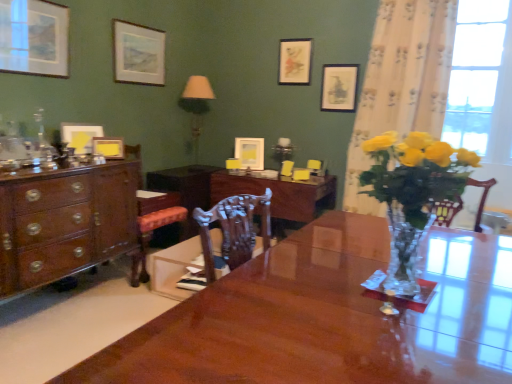
What do you see at coordinates (65, 222) in the screenshot?
I see `mahogany wood chest of drawers at left` at bounding box center [65, 222].

What do you see at coordinates (108, 147) in the screenshot?
I see `matte yellow picture frame at center, acting as the 5th picture frame starting from the right` at bounding box center [108, 147].

Locate an element on the screen. Image resolution: width=512 pixels, height=384 pixels. wooden table at center is located at coordinates (279, 193).

How much space does matte white picture frame at upper left, which is the first picture frame from left to right, occupy vertically?

19.13 inches.

Describe the element at coordinates (287, 168) in the screenshot. The image size is (512, 384). I see `wooden armchair at center, acting as the 2th armchair starting from the right` at that location.

The width and height of the screenshot is (512, 384). Describe the element at coordinates (412, 193) in the screenshot. I see `translucent glass vase at center` at that location.

Where is `mahogany wood chest of drawers at left`? Image resolution: width=512 pixels, height=384 pixels. mahogany wood chest of drawers at left is located at coordinates (65, 222).

From a real-world perspective, is matte white picture frame at upper left, which is the first picture frame from left to right, above or below matte yellow picture frame at center, which is the 3th picture frame in left-to-right order?

From a real-world perspective, matte white picture frame at upper left, which is the first picture frame from left to right, is physically above matte yellow picture frame at center, which is the 3th picture frame in left-to-right order.

Does matte white picture frame at upper left, which is the first picture frame from left to right, have a greater width compared to matte yellow picture frame at center, which is the 3th picture frame in left-to-right order?

Incorrect, the width of matte white picture frame at upper left, which is the first picture frame from left to right, does not surpass that of matte yellow picture frame at center, which is the 3th picture frame in left-to-right order.

Are matte white picture frame at upper left, which is the first picture frame from left to right, and matte yellow picture frame at center, which is the 3th picture frame in left-to-right order, beside each other?

No, matte white picture frame at upper left, which is the first picture frame from left to right, is not with matte yellow picture frame at center, which is the 3th picture frame in left-to-right order.

Is matte white picture frame at upper left, the 7th picture frame positioned from the right, bigger or smaller than matte yellow picture frame at center, which is the 3th picture frame in left-to-right order?

Considering their sizes, matte white picture frame at upper left, the 7th picture frame positioned from the right, takes up more space than matte yellow picture frame at center, which is the 3th picture frame in left-to-right order.

Can you confirm if white floral fabric curtain at right is taller than matte yellow picture frame at upper left, which is the 2th picture frame from left to right?

Yes.

Can matte yellow picture frame at upper left, which is counted as the 6th picture frame, starting from the right, be found inside white floral fabric curtain at right?

No.

From a real-world perspective, is white floral fabric curtain at right located higher than matte yellow picture frame at upper left, which is the 2th picture frame from left to right?

Indeed, from a real-world perspective, white floral fabric curtain at right stands above matte yellow picture frame at upper left, which is the 2th picture frame from left to right.

Does white floral fabric curtain at right turn towards matte yellow picture frame at upper left, which is the 2th picture frame from left to right?

No, white floral fabric curtain at right is not aimed at matte yellow picture frame at upper left, which is the 2th picture frame from left to right.

Considering the positions of objects matte white picture frame at upper center, which is the 4th picture frame from right to left, and matte white picture frame at upper left, which is the first picture frame from left to right, in the image provided, who is more to the left, matte white picture frame at upper center, which is the 4th picture frame from right to left, or matte white picture frame at upper left, which is the first picture frame from left to right,?

Positioned to the left is matte white picture frame at upper left, which is the first picture frame from left to right.

Can matte white picture frame at upper left, the 7th picture frame positioned from the right, be found inside matte white picture frame at upper center, the fourth picture frame viewed from the left?

That's incorrect, matte white picture frame at upper left, the 7th picture frame positioned from the right, is not inside matte white picture frame at upper center, the fourth picture frame viewed from the left.

Is matte white picture frame at upper center, which is the 4th picture frame from right to left, next to matte white picture frame at upper left, the 7th picture frame positioned from the right, and touching it?

No, matte white picture frame at upper center, which is the 4th picture frame from right to left, is not next to matte white picture frame at upper left, the 7th picture frame positioned from the right.

Does matte white picture frame at upper center, the fourth picture frame viewed from the left, have a greater width compared to matte white picture frame at upper left, which is the first picture frame from left to right?

No.

Is point (182, 195) in front of point (477, 152)?

No, it is not.

Is mahogany wood cabinet at center not close to clear glass window at upper right?

Yes, mahogany wood cabinet at center and clear glass window at upper right are quite far apart.

From the image's perspective, is mahogany wood cabinet at center located above or below clear glass window at upper right?

mahogany wood cabinet at center is situated lower than clear glass window at upper right in the image.

From a real-world perspective, is wooden armchair at center, which appears as the 2th armchair when viewed from the left, physically located above or below wooden table at center?

From a real-world perspective, wooden armchair at center, which appears as the 2th armchair when viewed from the left, is physically above wooden table at center.

From the image's perspective, which one is positioned higher, wooden armchair at center, the 1th armchair positioned from the right, or wooden table at center?

wooden armchair at center, the 1th armchair positioned from the right.

From the picture: Considering the sizes of wooden armchair at center, which appears as the 2th armchair when viewed from the left, and wooden table at center in the image, is wooden armchair at center, which appears as the 2th armchair when viewed from the left, bigger or smaller than wooden table at center?

In the image, wooden armchair at center, which appears as the 2th armchair when viewed from the left, appears to be smaller than wooden table at center.

Is wooden armchair at center, the 1th armchair positioned from the right, further to camera compared to wooden table at center?

Yes, it is behind wooden table at center.

Between wooden armchair at center, placed as the 1th armchair when sorted from left to right, and matte yellow picture frame at center, arranged as the third picture frame when viewed from the right, which one has larger width?

matte yellow picture frame at center, arranged as the third picture frame when viewed from the right, is wider.

Considering the relative sizes of wooden armchair at center, acting as the 2th armchair starting from the right, and matte yellow picture frame at center, arranged as the third picture frame when viewed from the right, in the image provided, is wooden armchair at center, acting as the 2th armchair starting from the right, bigger than matte yellow picture frame at center, arranged as the third picture frame when viewed from the right,?

No.

Looking at this image, between wooden armchair at center, placed as the 1th armchair when sorted from left to right, and matte yellow picture frame at center, the fifth picture frame when ordered from left to right, which one has less height?

wooden armchair at center, placed as the 1th armchair when sorted from left to right.

From the image's perspective, relative to matte yellow picture frame at center, arranged as the third picture frame when viewed from the right, is wooden armchair at center, placed as the 1th armchair when sorted from left to right, above or below?

Clearly, from the image's perspective, wooden armchair at center, placed as the 1th armchair when sorted from left to right, is below matte yellow picture frame at center, arranged as the third picture frame when viewed from the right.

Image resolution: width=512 pixels, height=384 pixels. In order to click on the 2nd armchair directly beneath the matte paper picture frame at upper center, the 2th picture frame viewed from the right (from a real-world perspective) in this screenshot , I will do `click(287, 168)`.

In the image, is matte paper picture frame at upper center, the 2th picture frame viewed from the right, positioned in front of or behind wooden armchair at center, placed as the 1th armchair when sorted from left to right?

Clearly, matte paper picture frame at upper center, the 2th picture frame viewed from the right, is behind wooden armchair at center, placed as the 1th armchair when sorted from left to right.

Is matte paper picture frame at upper center, the 2th picture frame viewed from the right, touching wooden armchair at center, acting as the 2th armchair starting from the right?

matte paper picture frame at upper center, the 2th picture frame viewed from the right, and wooden armchair at center, acting as the 2th armchair starting from the right, are not in contact.

From the image's perspective, is matte paper picture frame at upper center, the 2th picture frame viewed from the right, located above or below wooden armchair at center, placed as the 1th armchair when sorted from left to right?

From the image's perspective, matte paper picture frame at upper center, the 2th picture frame viewed from the right, appears above wooden armchair at center, placed as the 1th armchair when sorted from left to right.

From a real-world perspective, starting from the matte white picture frame at upper left, the 7th picture frame positioned from the right, which picture frame is the 3rd one below it? Please provide its 2D coordinates.

[(108, 147)]

Identify the location of picture frame that is the 6th one when counting leftward from the white floral fabric curtain at right. (80, 136).

Looking at the image, which one is located closer to white floral fabric curtain at right, wooden armchair at center, acting as the 2th armchair starting from the right, or translucent glass lamp at upper center?

wooden armchair at center, acting as the 2th armchair starting from the right, is positioned closer to the anchor white floral fabric curtain at right.

Estimate the real-world distances between objects in this image. Which object is closer to matte white picture frame at upper center, which is the 4th picture frame from right to left, matte yellow picture frame at center, the fifth picture frame when ordered from left to right, or matte paper picture frame at upper center, the 2th picture frame viewed from the right?

matte yellow picture frame at center, the fifth picture frame when ordered from left to right, is positioned closer to the anchor matte white picture frame at upper center, which is the 4th picture frame from right to left.

When comparing their distances from matte white picture frame at upper center, the fourth picture frame viewed from the left, does matte white picture frame at upper left, the 7th picture frame positioned from the right, or white floral fabric curtain at right seem closer?

The object closer to matte white picture frame at upper center, the fourth picture frame viewed from the left, is matte white picture frame at upper left, the 7th picture frame positioned from the right.

Considering their positions, is mahogany wood cabinet at center positioned closer to wooden armchair at center, which appears as the 2th armchair when viewed from the left, than white floral fabric curtain at right?

white floral fabric curtain at right is positioned closer to the anchor wooden armchair at center, which appears as the 2th armchair when viewed from the left.

When comparing their distances from glossy wood desk at center, does wooden armchair at center, which appears as the 2th armchair when viewed from the left, or translucent glass vase at center seem closer?

translucent glass vase at center is positioned closer to the anchor glossy wood desk at center.

Based on their spatial positions, is wooden armchair at center, the 1th armchair positioned from the right, or matte yellow picture frame at center, which is the 3th picture frame in left-to-right order, further from matte white picture frame at upper center, which is the 4th picture frame from right to left?

wooden armchair at center, the 1th armchair positioned from the right, lies further to matte white picture frame at upper center, which is the 4th picture frame from right to left, than the other object.

From the image, which object appears to be nearer to wooden table at center, mahogany wood chest of drawers at left or wooden armchair at center, acting as the 2th armchair starting from the right?

wooden armchair at center, acting as the 2th armchair starting from the right, is positioned closer to the anchor wooden table at center.

Estimate the real-world distances between objects in this image. Which object is closer to matte yellow picture frame at upper left, which is counted as the 6th picture frame, starting from the right, translucent glass lamp at upper center or mahogany wood chest of drawers at left?

mahogany wood chest of drawers at left is closer to matte yellow picture frame at upper left, which is counted as the 6th picture frame, starting from the right.

At what (x,y) coordinates should I click in order to perform the action: click on cabinetry located between translucent glass vase at center and matte yellow picture frame at center, the fifth picture frame when ordered from left to right, in the depth direction. Please return your answer as a coordinate pair (x, y). This screenshot has width=512, height=384. Looking at the image, I should click on (185, 187).

I want to click on armchair located between translucent glass vase at center and wooden armchair at center, which appears as the 2th armchair when viewed from the left, in the depth direction, so click(x=287, y=168).

Find the location of a particular element. This screenshot has height=384, width=512. cabinetry situated between matte white picture frame at upper center, the fourth picture frame viewed from the left, and clear glass window at upper right from left to right is located at coordinates tap(185, 187).

I want to click on cabinetry between matte yellow picture frame at upper left, which is counted as the 6th picture frame, starting from the right, and matte yellow picture frame at center, the fifth picture frame when ordered from left to right, in the front-back direction, so click(x=185, y=187).